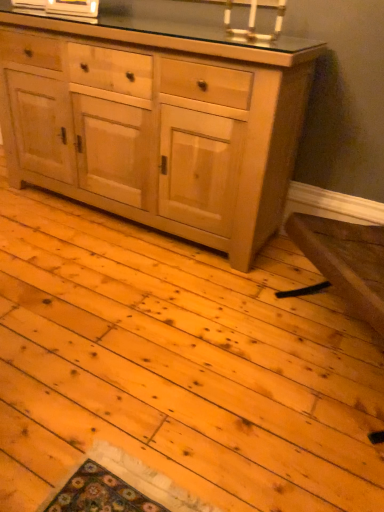
Question: Considering the positions of point (163, 130) and point (235, 1), is point (163, 130) closer or farther from the camera than point (235, 1)?

Choices:
 (A) closer
 (B) farther

Answer: (B)

Question: From a real-world perspective, is natural wood cabinet at center above or below white ceramic candle holder at upper center?

Choices:
 (A) below
 (B) above

Answer: (A)

Question: In terms of size, does natural wood cabinet at center appear bigger or smaller than white ceramic candle holder at upper center?

Choices:
 (A) small
 (B) big

Answer: (B)

Question: Is point (228, 29) positioned closer to the camera than point (288, 169)?

Choices:
 (A) farther
 (B) closer

Answer: (B)

Question: Looking at their shapes, would you say white ceramic candle holder at upper center is wider or thinner than natural wood cabinet at center?

Choices:
 (A) wide
 (B) thin

Answer: (B)

Question: Is white ceramic candle holder at upper center bigger or smaller than natural wood cabinet at center?

Choices:
 (A) big
 (B) small

Answer: (B)

Question: From the image's perspective, is white ceramic candle holder at upper center above or below natural wood cabinet at center?

Choices:
 (A) below
 (B) above

Answer: (B)